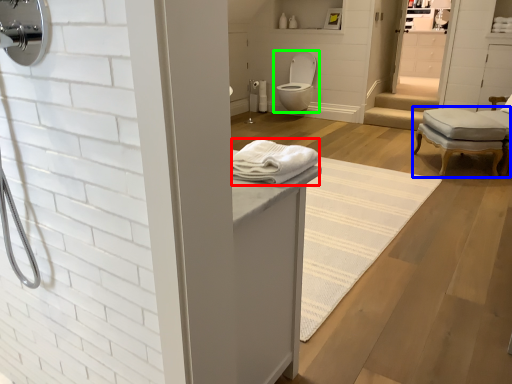
Question: Estimate the real-world distances between objects in this image. Which object is farther from bath towel (highlighted by a red box), chair (highlighted by a blue box) or toilet (highlighted by a green box)?

Choices:
 (A) chair
 (B) toilet

Answer: (B)